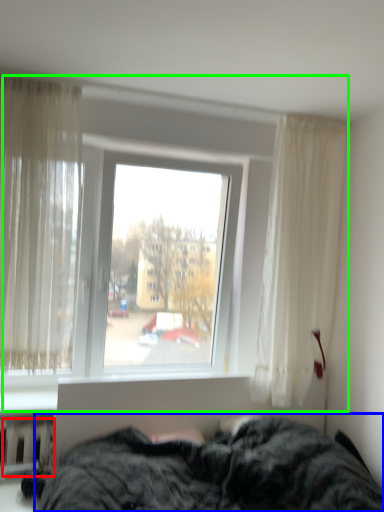
Question: Which object is positioned farthest from radiator (highlighted by a red box)? Select from bed (highlighted by a blue box) and window (highlighted by a green box).

Choices:
 (A) bed
 (B) window

Answer: (B)